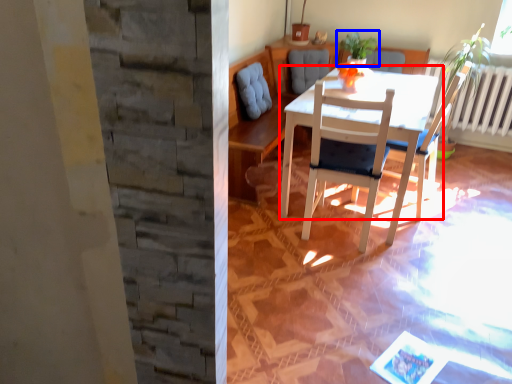
Question: Which of the following is the farthest to the observer, table (highlighted by a red box) or houseplant (highlighted by a blue box)?

Choices:
 (A) table
 (B) houseplant

Answer: (B)